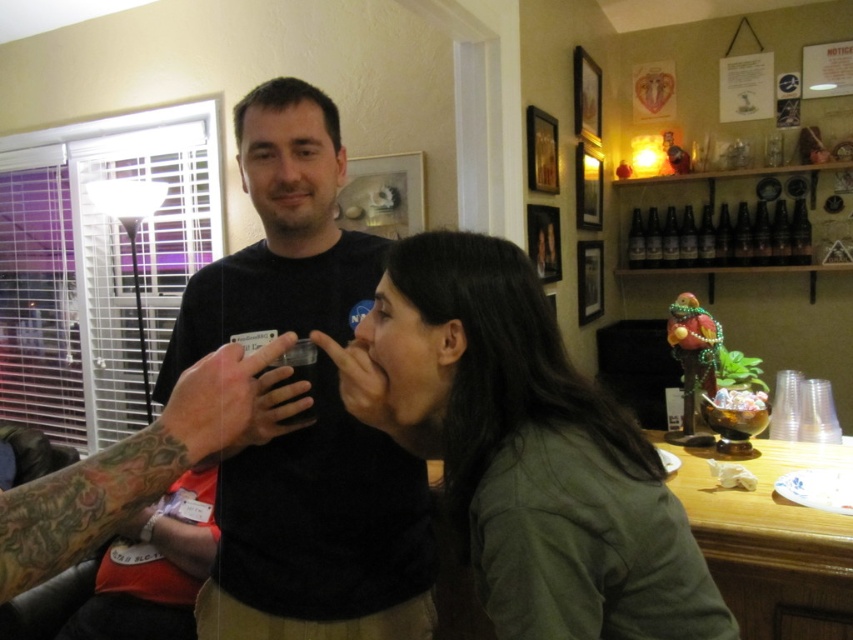
Question: Can you confirm if green matte shirt at center is positioned to the right of black matte shirt at upper center?

Choices:
 (A) no
 (B) yes

Answer: (B)

Question: Can you confirm if black matte shirt at upper center is thinner than translucent plastic cup at left?

Choices:
 (A) yes
 (B) no

Answer: (B)

Question: Which point is farther to the camera?

Choices:
 (A) (247, 545)
 (B) (511, 636)
 (C) (204, 362)

Answer: (A)

Question: Which point is closer to the camera taking this photo?

Choices:
 (A) (132, 444)
 (B) (508, 544)

Answer: (A)

Question: Which of the following is the closest to the observer?

Choices:
 (A) translucent plastic cup at left
 (B) black matte shirt at upper center

Answer: (A)

Question: Is black matte shirt at upper center behind translucent plastic cup at left?

Choices:
 (A) no
 (B) yes

Answer: (B)